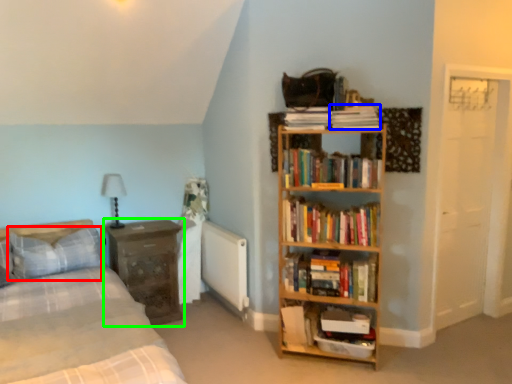
Question: Estimate the real-world distances between objects in this image. Which object is farther from pillow (highlighted by a red box), paperback book (highlighted by a blue box) or nightstand (highlighted by a green box)?

Choices:
 (A) paperback book
 (B) nightstand

Answer: (A)